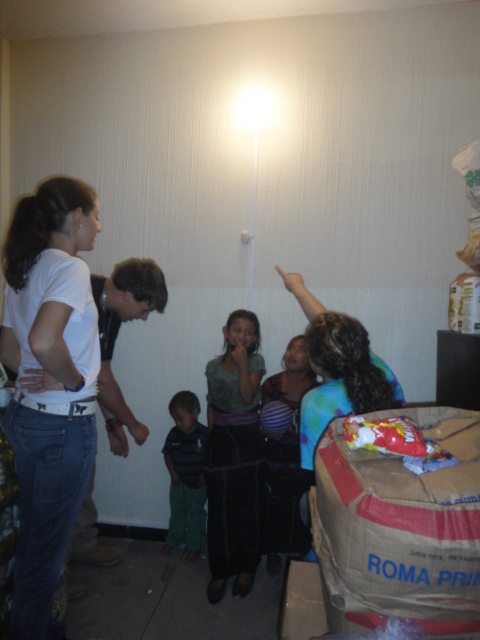
Does white matte t-shirt at left have a greater width compared to white matte shirt at left?

No, white matte t-shirt at left is not wider than white matte shirt at left.

Is point (50, 234) positioned after point (118, 300)?

No, (50, 234) is closer to viewer.

Between point (51, 381) and point (96, 305), which one is positioned behind?

The point (96, 305) is more distant.

I want to click on white matte t-shirt at left, so click(48, 385).

Which is more to the right, white matte shirt at left or striped polo shirt at center?

striped polo shirt at center

This screenshot has width=480, height=640. What are the coordinates of `white matte shirt at left` in the screenshot? It's located at (117, 336).

You are a GUI agent. You are given a task and a screenshot of the screen. Output one action in this format:
    pyautogui.click(x=<x>, y=<y>)
    Task: Click on the white matte shirt at left
    
    Given the screenshot: What is the action you would take?
    pyautogui.click(x=117, y=336)

Does white matte t-shirt at left appear over striped polo shirt at center?

Yes.

Between white matte t-shirt at left and striped polo shirt at center, which one has more height?

With more height is white matte t-shirt at left.

Which is in front, point (51, 317) or point (180, 433)?

Point (51, 317) is in front.

Where is `white matte t-shirt at left`? white matte t-shirt at left is located at coordinates (48, 385).